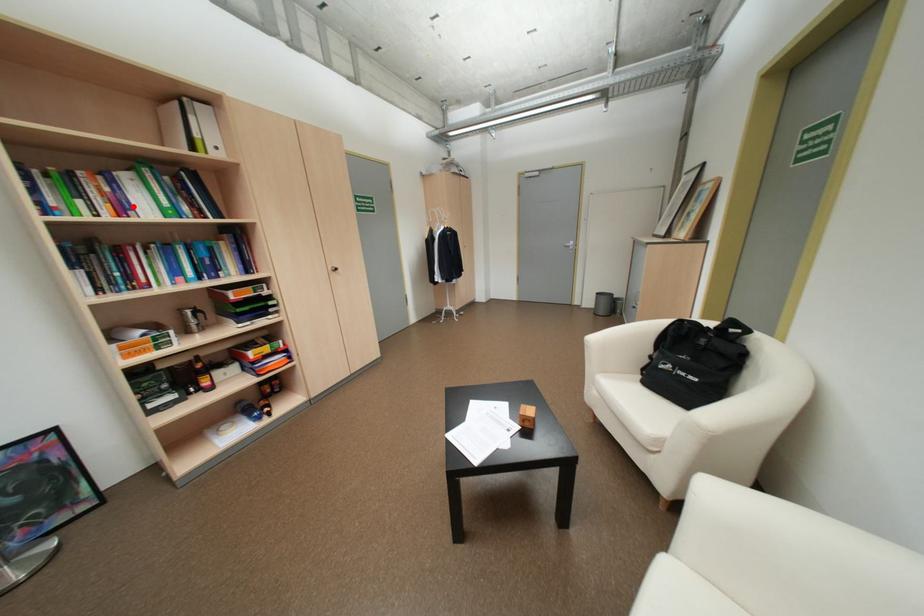
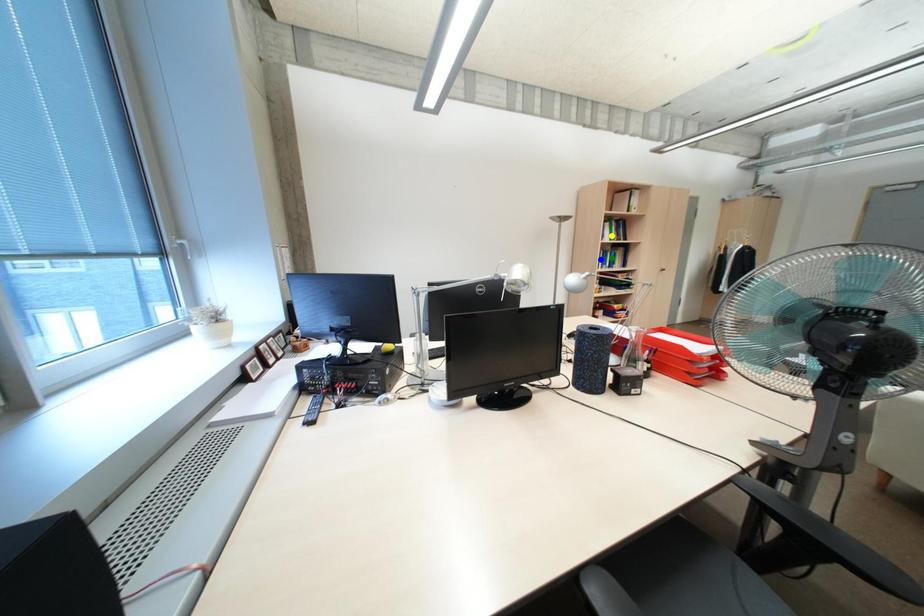
Question: I am providing you with two images of the same scene from different viewpoints. A red point is marked on the first image. You are given multiple points on the second image. In image 2, which mark is for the same physical point as the one in image 1?

Choices:
 (A) blue point
 (B) green point
 (C) yellow point

Answer: (C)